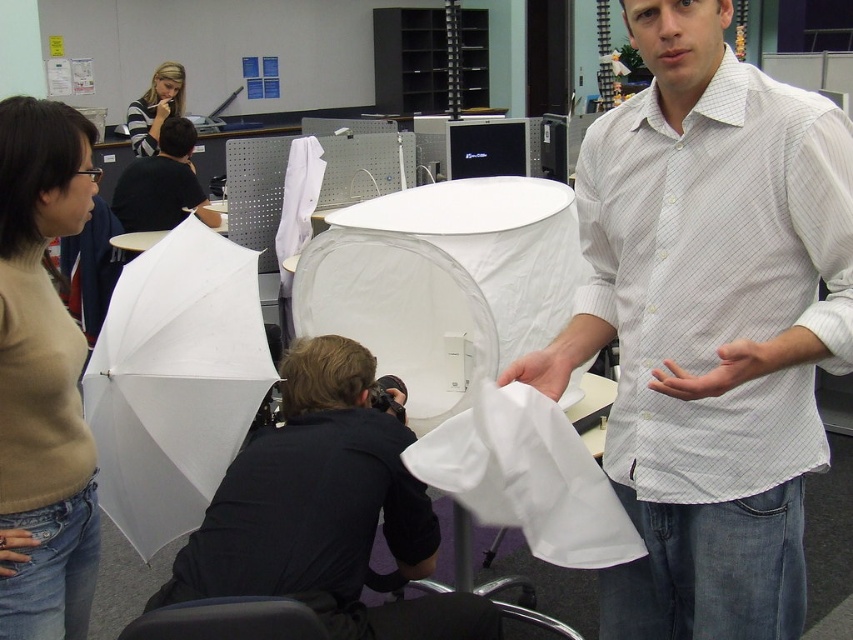
Is point (163, 326) closer to viewer compared to point (141, 109)?

Yes, it is in front of point (141, 109).

Which is in front, point (219, 348) or point (146, 112)?

Point (219, 348) is in front.

Where is `white matte umbrella at left`? This screenshot has height=640, width=853. white matte umbrella at left is located at coordinates (175, 381).

Consider the image. Is beige sweater at center behind matte black shirt at upper left?

That is False.

Is point (82, 161) positioned in front of point (148, 104)?

Yes, point (82, 161) is closer to viewer.

Does point (32, 378) come in front of point (167, 116)?

Yes, it is.

Find the location of a particular element. The height and width of the screenshot is (640, 853). beige sweater at center is located at coordinates (44, 374).

Who is more distant from viewer, (160, 301) or (180, 138)?

The point (180, 138) is more distant.

Is white matte umbrella at left positioned before black shirt at upper left?

Yes, white matte umbrella at left is closer to the viewer.

Is point (215, 349) positioned before point (115, 193)?

Yes, point (215, 349) is in front of point (115, 193).

This screenshot has height=640, width=853. Find the location of `white matte umbrella at left`. white matte umbrella at left is located at coordinates (175, 381).